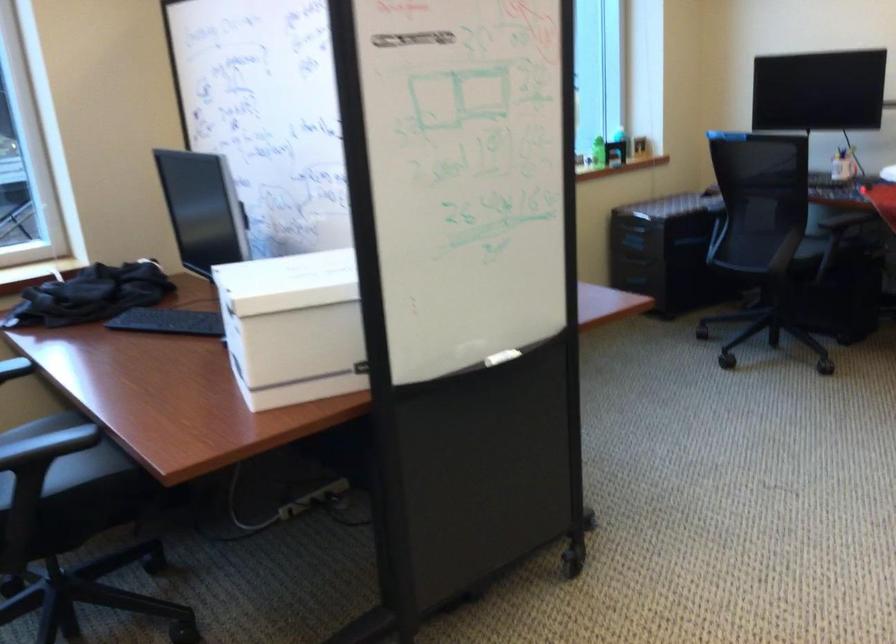
I want to click on green plastic bottle, so click(598, 152).